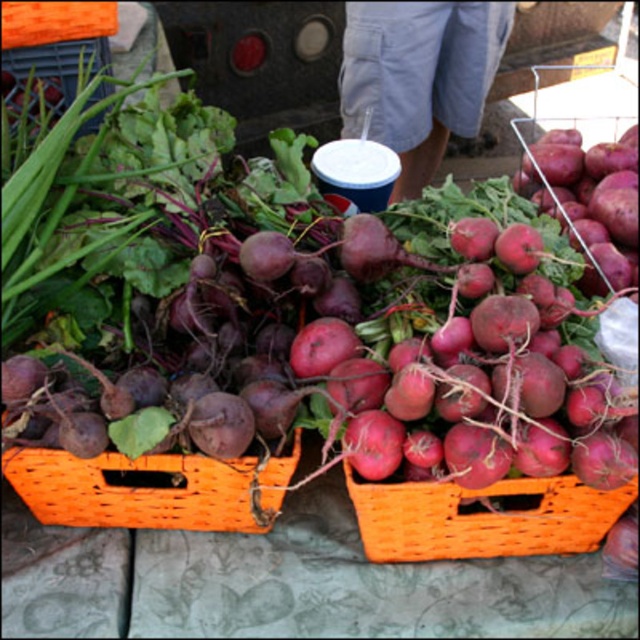
Question: Among these objects, which one is farthest from the camera?

Choices:
 (A) matte purple beetroot at center
 (B) orange woven basket at center
 (C) orange wicker basket at center

Answer: (B)

Question: Observing the image, what is the correct spatial positioning of orange wicker basket at center in reference to orange woven basket at center?

Choices:
 (A) below
 (B) above

Answer: (A)

Question: Which of the following is the closest to the observer?

Choices:
 (A) matte purple beetroot at center
 (B) orange woven basket at center
 (C) orange wicker basket at center

Answer: (A)

Question: Which point is farther to the camera?

Choices:
 (A) (604, 529)
 (B) (145, 401)

Answer: (A)

Question: Is matte purple beetroot at center above orange wicker basket at center?

Choices:
 (A) yes
 (B) no

Answer: (A)

Question: Is matte purple beetroot at center positioned in front of orange wicker basket at center?

Choices:
 (A) no
 (B) yes

Answer: (B)